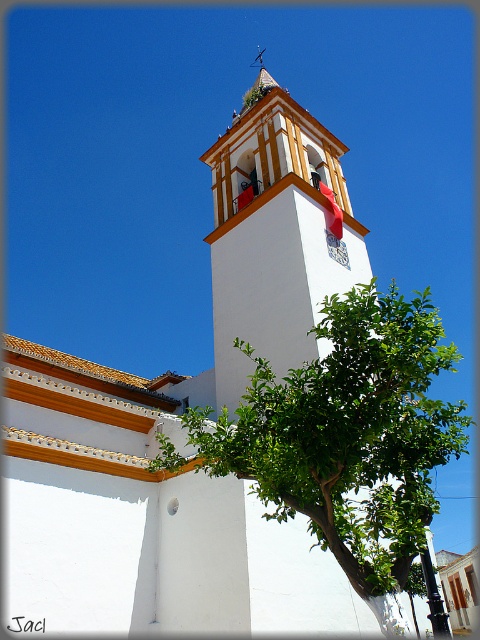
Question: Is green leafy tree at center thinner than white stucco tower at center?

Choices:
 (A) no
 (B) yes

Answer: (A)

Question: Is green leafy tree at center thinner than white stucco tower at center?

Choices:
 (A) no
 (B) yes

Answer: (A)

Question: Observing the image, what is the correct spatial positioning of green leafy tree at center in reference to white stucco tower at center?

Choices:
 (A) below
 (B) above

Answer: (A)

Question: Which point is farther to the camera?

Choices:
 (A) green leafy tree at center
 (B) white stucco tower at center

Answer: (B)

Question: Which point is closer to the camera?

Choices:
 (A) (259, 332)
 (B) (346, 561)

Answer: (B)